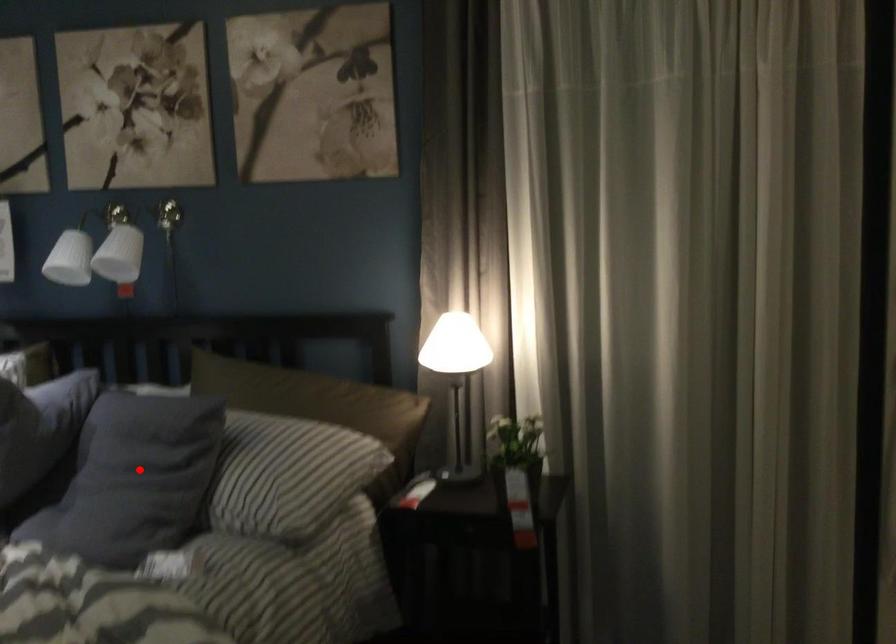
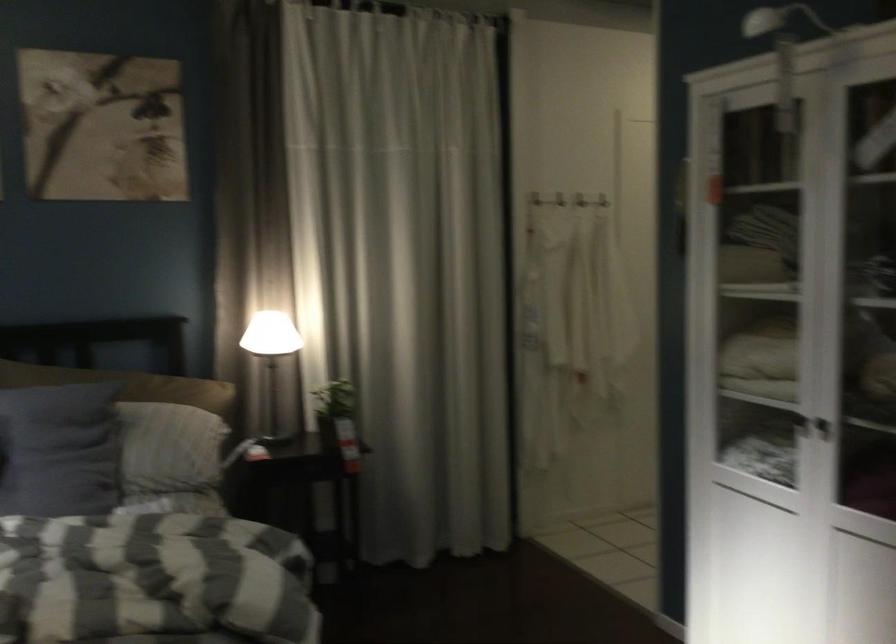
Locate, in the second image, the point that corresponds to the highlighted location in the first image.

(58, 450)